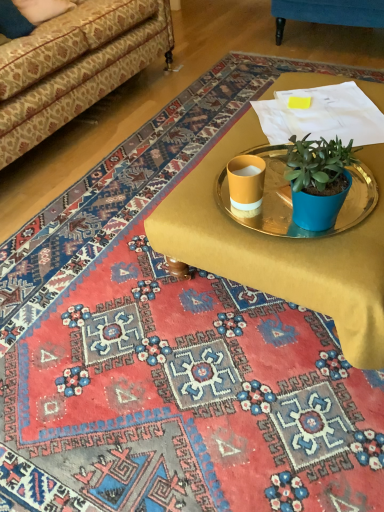
Question: From the image's perspective, is gold metallic tray at center above metallic gold tray at center?

Choices:
 (A) yes
 (B) no

Answer: (A)

Question: Considering the relative sizes of gold metallic tray at center and metallic gold tray at center in the image provided, is gold metallic tray at center taller than metallic gold tray at center?

Choices:
 (A) no
 (B) yes

Answer: (B)

Question: Can you confirm if gold metallic tray at center is wider than metallic gold tray at center?

Choices:
 (A) no
 (B) yes

Answer: (B)

Question: From a real-world perspective, is gold metallic tray at center located beneath metallic gold tray at center?

Choices:
 (A) yes
 (B) no

Answer: (A)

Question: Could you tell me if gold metallic tray at center is turned towards metallic gold tray at center?

Choices:
 (A) yes
 (B) no

Answer: (B)

Question: Considering the relative sizes of gold metallic tray at center and metallic gold tray at center in the image provided, is gold metallic tray at center bigger than metallic gold tray at center?

Choices:
 (A) no
 (B) yes

Answer: (B)

Question: Can you confirm if gold metallic tray at center is shorter than patterned fabric couch at upper left?

Choices:
 (A) no
 (B) yes

Answer: (B)

Question: Can you confirm if gold metallic tray at center is taller than patterned fabric couch at upper left?

Choices:
 (A) yes
 (B) no

Answer: (B)

Question: Is gold metallic tray at center aimed at patterned fabric couch at upper left?

Choices:
 (A) yes
 (B) no

Answer: (A)

Question: Is gold metallic tray at center looking in the opposite direction of patterned fabric couch at upper left?

Choices:
 (A) yes
 (B) no

Answer: (B)

Question: From the image's perspective, is gold metallic tray at center beneath patterned fabric couch at upper left?

Choices:
 (A) no
 (B) yes

Answer: (B)

Question: Does gold metallic tray at center have a larger size compared to patterned fabric couch at upper left?

Choices:
 (A) yes
 (B) no

Answer: (B)

Question: Is metallic gold tray at center not within patterned fabric couch at upper left?

Choices:
 (A) no
 (B) yes

Answer: (B)